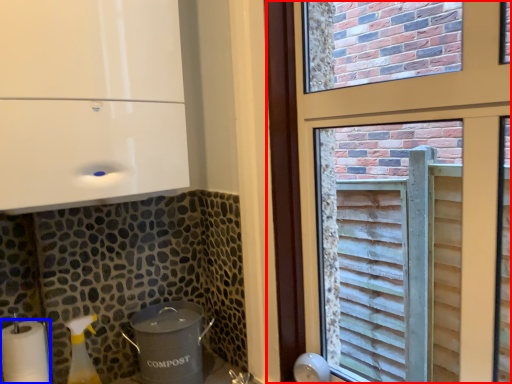
Question: Among these objects, which one is nearest to the camera, window (highlighted by a red box) or paper towel (highlighted by a blue box)?

Choices:
 (A) window
 (B) paper towel

Answer: (A)